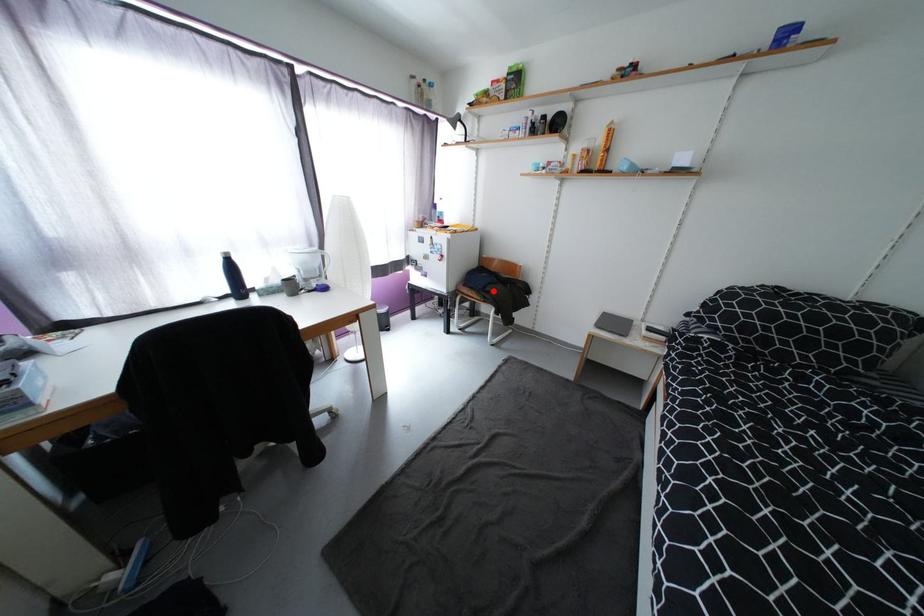
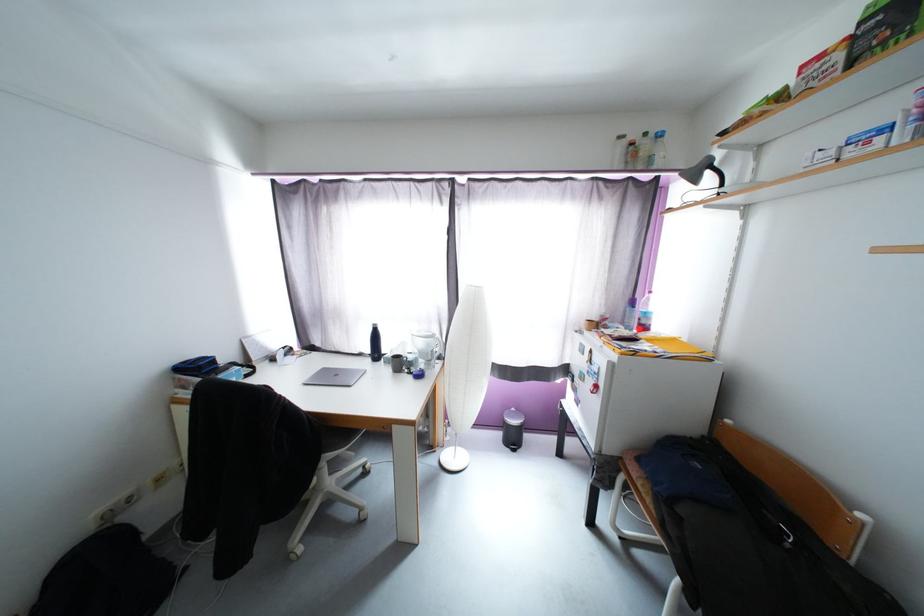
Question: I am providing you with two images of the same scene from different viewpoints. In image1, a red point is highlighted. Considering the same 3D point in image2, which of the following is correct?

Choices:
 (A) It is closer
 (B) It is farther

Answer: (B)